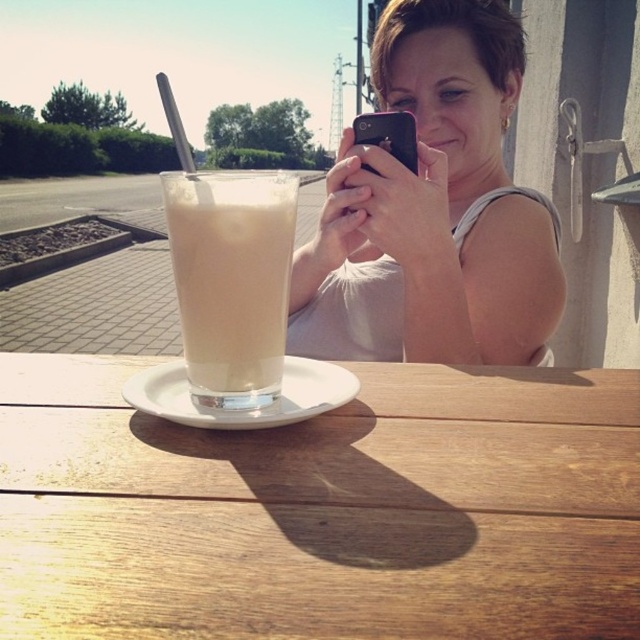
You are a delivery robot that needs to place a small package on the table without disturbing the matte white tank top at upper center or the black matte smartphone at center. What is the minimum distance you should maintain between the package and each object to ensure they are not touched?

The minimum distance you should maintain between the package and each object is half of the distance between the matte white tank top at upper center and the black matte smartphone at center. Since they are 5.37 inches apart, half of that is approximately 2.685 inches. Therefore, maintaining at least 2.69 inches between the package and each object ensures neither is touched.

You are standing at the center of the image. Which object is located at the coordinates point (323, 509)?

The wooden table at center is located at the coordinates point (323, 509).

You are a photographer taking a portrait of the person in the scene. You notice the matte white tank top at upper center and the black matte smartphone at center. Which object should you focus on first to ensure it appears sharp in the photo?

You should focus on the black matte smartphone at center first because the matte white tank top at upper center is below it, meaning the smartphone is closer to the camera and will require focus adjustment before the tank top.